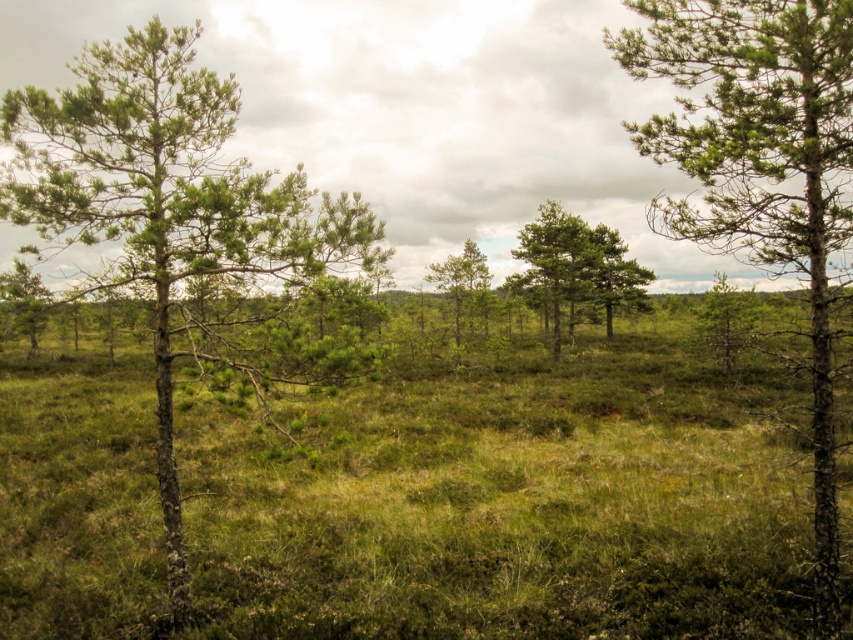
Question: Is green textured tree at right to the right of green matte tree at center from the viewer's perspective?

Choices:
 (A) no
 (B) yes

Answer: (B)

Question: Among these objects, which one is farthest from the camera?

Choices:
 (A) green textured tree at right
 (B) green rough bark tree at left
 (C) green matte tree at center
 (D) green textured tree at center

Answer: (C)

Question: Is green textured tree at center smaller than green matte tree at center?

Choices:
 (A) yes
 (B) no

Answer: (B)

Question: Does green rough bark tree at left appear over green matte tree at center?

Choices:
 (A) yes
 (B) no

Answer: (A)

Question: Which object appears farthest from the camera in this image?

Choices:
 (A) green rough bark tree at left
 (B) green textured tree at center

Answer: (B)

Question: Which of the following is the farthest from the observer?

Choices:
 (A) green matte tree at center
 (B) green textured tree at right

Answer: (A)